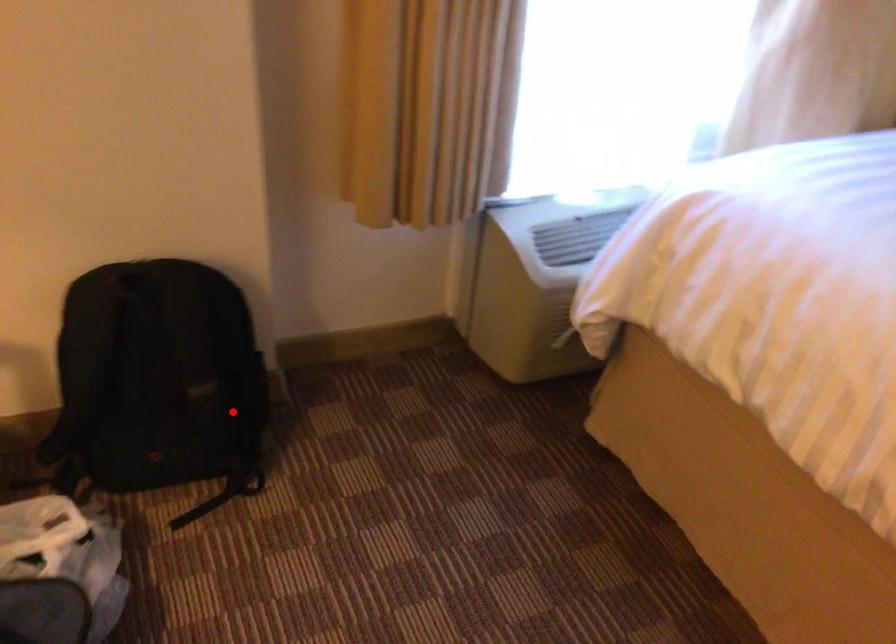
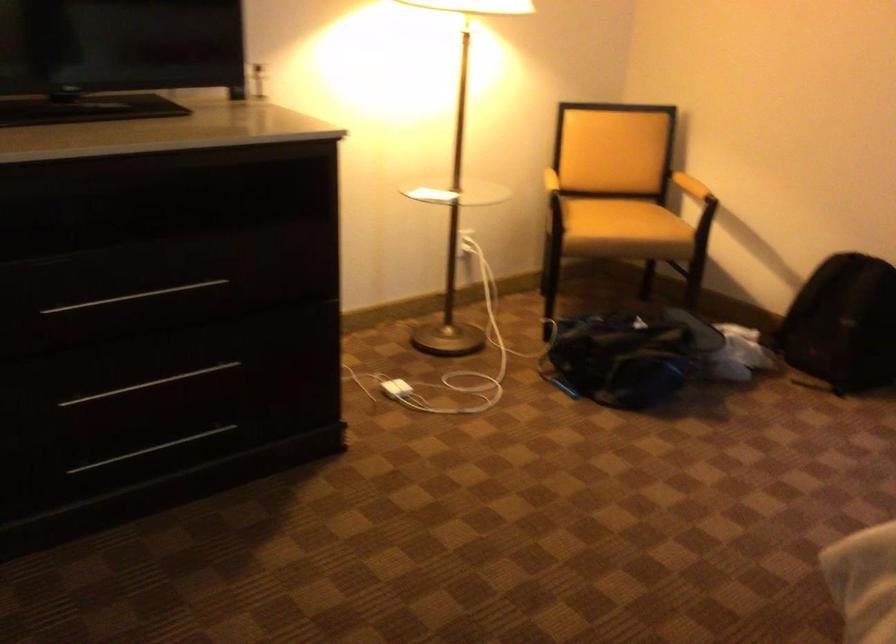
Question: I am providing you with two images of the same scene from different viewpoints. In image1, a red point is highlighted. Considering the same 3D point in image2, which of the following is correct?

Choices:
 (A) It is closer
 (B) It is farther

Answer: (B)